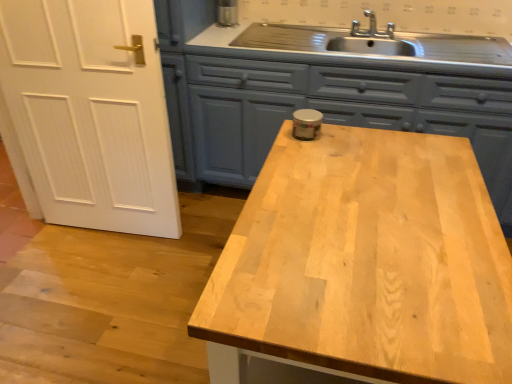
Find the location of a particular element. The width and height of the screenshot is (512, 384). vacant area on top of light wood countertop at center (from a real-world perspective) is located at coordinates (372, 218).